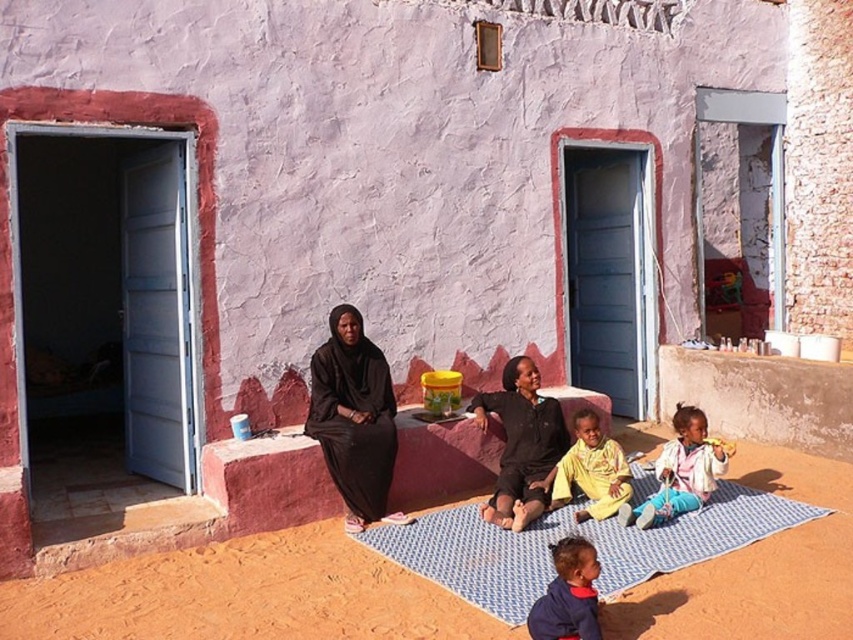
Is light pink fabric pants at lower right wider than yellow cotton shirt at center?

Yes.

Does light pink fabric pants at lower right have a smaller size compared to yellow cotton shirt at center?

No.

Is point (677, 472) positioned before point (556, 472)?

Yes, point (677, 472) is in front of point (556, 472).

Locate an element on the screen. The image size is (853, 640). light pink fabric pants at lower right is located at coordinates (682, 472).

Measure the distance between point (326,352) and camera.

Point (326,352) and camera are 5.88 meters apart from each other.

Can you confirm if black matte dress at center is taller than dark blue fleece jacket at lower center?

Yes.

Image resolution: width=853 pixels, height=640 pixels. What do you see at coordinates (352, 417) in the screenshot?
I see `black matte dress at center` at bounding box center [352, 417].

Identify the location of black matte dress at center. (352, 417).

Between point (711, 460) and point (575, 602), which one is positioned behind?

Positioned behind is point (711, 460).

Is light pink fabric pants at lower right bigger than dark blue fleece jacket at lower center?

Correct, light pink fabric pants at lower right is larger in size than dark blue fleece jacket at lower center.

This screenshot has height=640, width=853. Identify the location of light pink fabric pants at lower right. (682, 472).